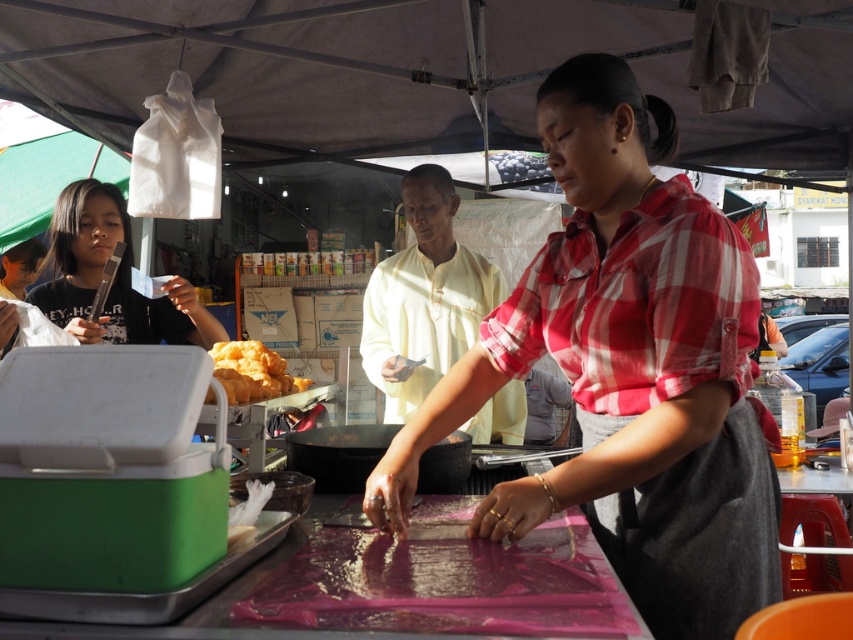
This screenshot has height=640, width=853. I want to click on plaid fabric shirt at center, so click(x=627, y=371).

Between point (598, 380) and point (372, 374), which one is positioned in front?

Point (598, 380)

Is point (525, 506) positioned after point (415, 276)?

No, it is not.

Where is `plaid fabric shirt at center`? This screenshot has width=853, height=640. plaid fabric shirt at center is located at coordinates (627, 371).

Who is positioned more to the left, yellow cotton shirt at center or golden crispy fried food at center?

Positioned to the left is golden crispy fried food at center.

Does yellow cotton shirt at center lie in front of golden crispy fried food at center?

No, yellow cotton shirt at center is further to the viewer.

The image size is (853, 640). Find the location of `yellow cotton shirt at center`. yellow cotton shirt at center is located at coordinates (424, 298).

What do you see at coordinates (114, 276) in the screenshot? I see `black matte shirt at left` at bounding box center [114, 276].

Does black matte shirt at left come behind golden crispy fried food at center?

Yes, it is.

Who is more distant from viewer, [105,192] or [270,369]?

The point [105,192] is behind.

This screenshot has width=853, height=640. Identify the location of black matte shirt at left. (114, 276).